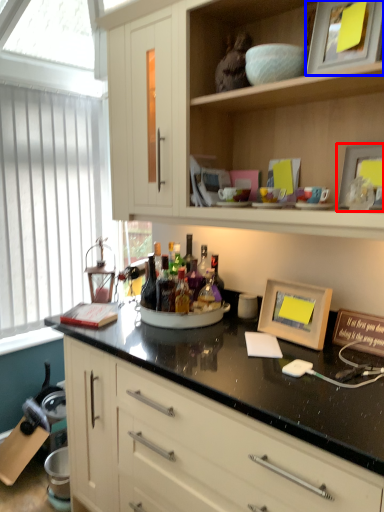
Question: Which point is further to the camera, picture frame (highlighted by a red box) or picture frame (highlighted by a blue box)?

Choices:
 (A) picture frame
 (B) picture frame

Answer: (A)